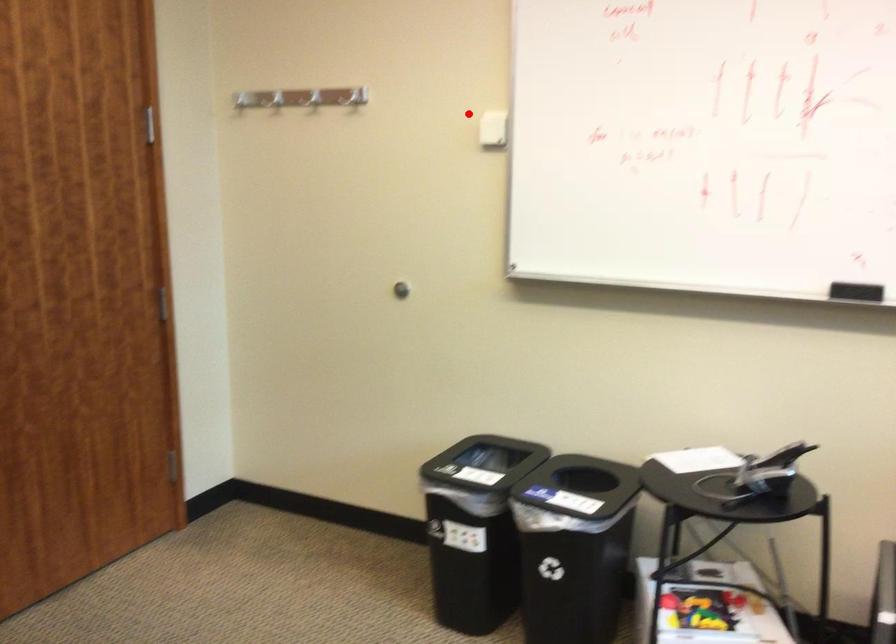
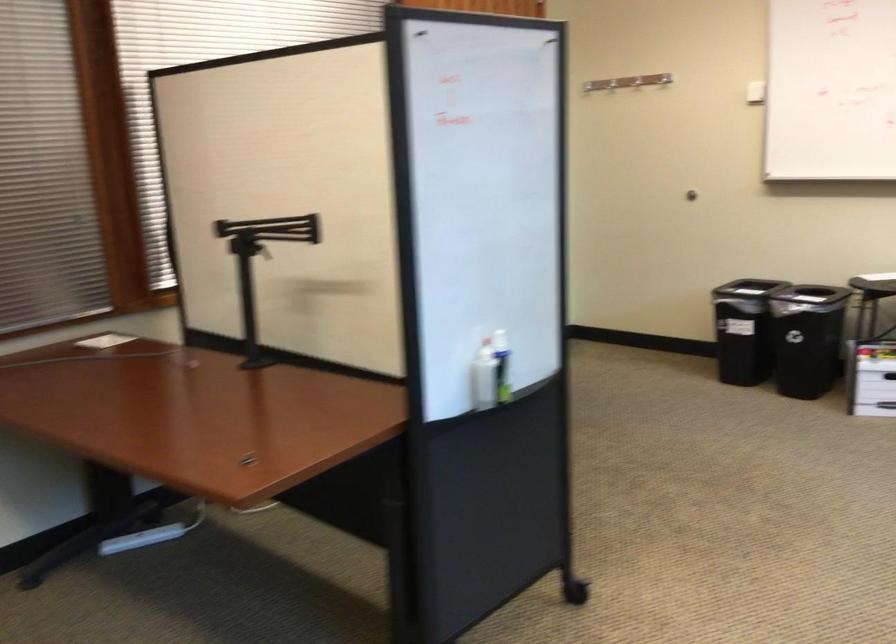
Locate, in the second image, the point that corresponds to the highlighted location in the first image.

(664, 79)